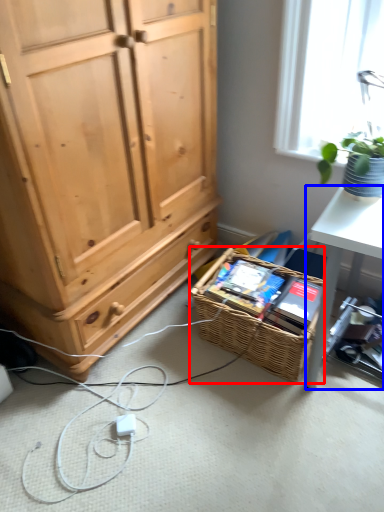
Question: Which of the following is the farthest to the observer, picnic basket (highlighted by a red box) or desk (highlighted by a blue box)?

Choices:
 (A) picnic basket
 (B) desk

Answer: (B)